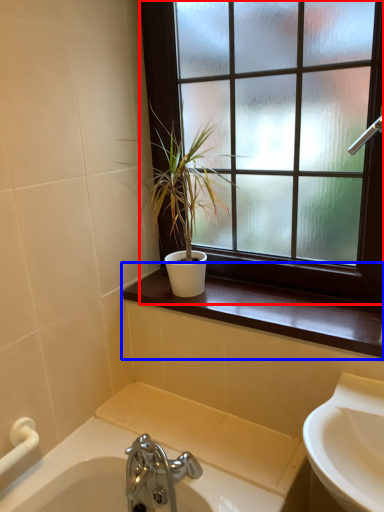
Question: Which object is closer to the camera taking this photo, window (highlighted by a red box) or window sill (highlighted by a blue box)?

Choices:
 (A) window
 (B) window sill

Answer: (A)